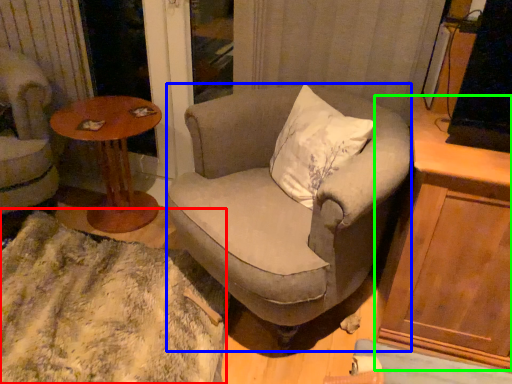
Question: Which object is positioned closest to blanket (highlighted by a red box)? Select from chair (highlighted by a blue box) and cabinetry (highlighted by a green box).

Choices:
 (A) chair
 (B) cabinetry

Answer: (A)